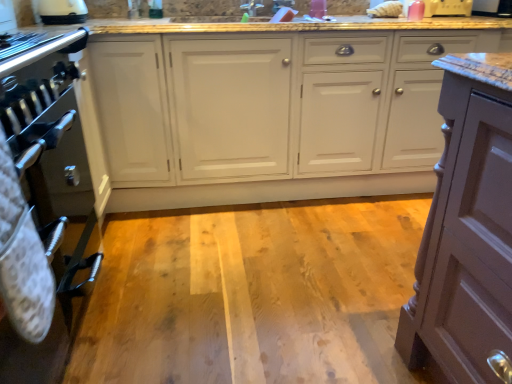
This screenshot has width=512, height=384. What are the coordinates of `free space above wooden floor at center (from a real-world perspective)` in the screenshot? It's located at (271, 264).